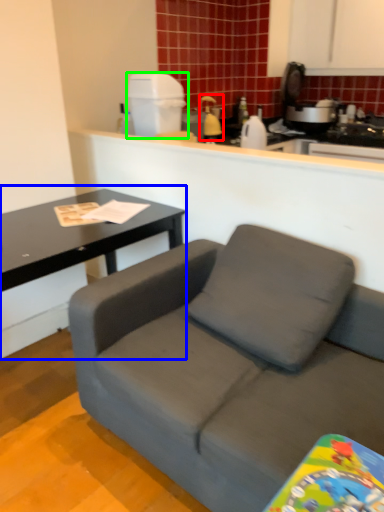
Question: Considering the real-world distances, which object is farthest from appliance (highlighted by a red box)? coffee table (highlighted by a blue box) or appliance (highlighted by a green box)?

Choices:
 (A) coffee table
 (B) appliance

Answer: (A)